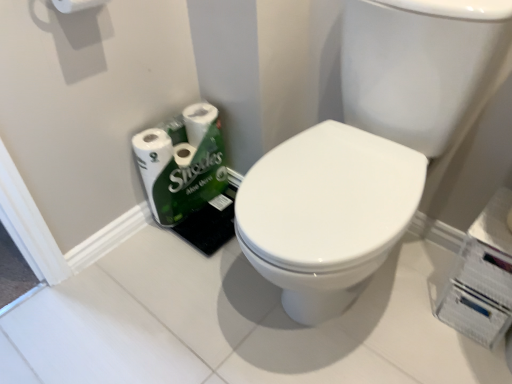
This screenshot has width=512, height=384. Find the location of `white matte toilet paper at upper left, arranged as the second toilet paper when ordered from the bottom`. white matte toilet paper at upper left, arranged as the second toilet paper when ordered from the bottom is located at coordinates (76, 5).

How much space does white glossy toilet paper at lower left, arranged as the first toilet paper when ordered from the bottom, occupy horizontally?

16.22 centimeters.

Locate an element on the screen. white glossy sink at center is located at coordinates (370, 147).

Visually, is white glossy sink at center positioned to the left or to the right of white glossy toilet paper at lower left, the first toilet paper when ordered from back to front?

Clearly, white glossy sink at center is on the right of white glossy toilet paper at lower left, the first toilet paper when ordered from back to front, in the image.

Does white glossy sink at center have a greater height compared to white glossy toilet paper at lower left, arranged as the first toilet paper when ordered from the bottom?

Yes, white glossy sink at center is taller than white glossy toilet paper at lower left, arranged as the first toilet paper when ordered from the bottom.

In the scene shown: Considering their positions, is white glossy sink at center located in front of or behind white glossy toilet paper at lower left, the first toilet paper when ordered from back to front?

white glossy sink at center is in front of white glossy toilet paper at lower left, the first toilet paper when ordered from back to front.

Would you say white matte toilet paper at upper left, positioned as the 1th toilet paper in top-to-bottom order, is outside white glossy toilet paper at lower left, the first toilet paper when ordered from back to front?

Yes, white matte toilet paper at upper left, positioned as the 1th toilet paper in top-to-bottom order, is not within white glossy toilet paper at lower left, the first toilet paper when ordered from back to front.

Is white matte toilet paper at upper left, which ranks as the 2th toilet paper in back-to-front order, facing away from white glossy toilet paper at lower left, arranged as the first toilet paper when ordered from the bottom?

That's not correct — white matte toilet paper at upper left, which ranks as the 2th toilet paper in back-to-front order, is not looking away from white glossy toilet paper at lower left, arranged as the first toilet paper when ordered from the bottom.

In the image, there is a white matte toilet paper at upper left, positioned as the 1th toilet paper in top-to-bottom order. Where is `toilet paper below it (from the image's perspective)`? The height and width of the screenshot is (384, 512). toilet paper below it (from the image's perspective) is located at coordinates (182, 163).

Is white matte toilet paper at upper left, marked as the first toilet paper in a front-to-back arrangement, smaller than white glossy toilet paper at lower left, the second toilet paper positioned from the front?

Yes, white matte toilet paper at upper left, marked as the first toilet paper in a front-to-back arrangement, is smaller than white glossy toilet paper at lower left, the second toilet paper positioned from the front.

Is white glossy toilet paper at lower left, arranged as the first toilet paper when ordered from the bottom, far from white glossy sink at center?

No, there isn't a large distance between white glossy toilet paper at lower left, arranged as the first toilet paper when ordered from the bottom, and white glossy sink at center.

What's the angular difference between white glossy toilet paper at lower left, the second toilet paper positioned from the front, and white glossy sink at center's facing directions?

85.6 degrees.

From the image's perspective, is white glossy toilet paper at lower left, arranged as the first toilet paper when ordered from the bottom, over white glossy sink at center?

Yes.

Considering the sizes of objects white glossy toilet paper at lower left, which is counted as the second toilet paper, starting from the top, and white glossy sink at center in the image provided, who is thinner, white glossy toilet paper at lower left, which is counted as the second toilet paper, starting from the top, or white glossy sink at center?

white glossy toilet paper at lower left, which is counted as the second toilet paper, starting from the top, is thinner.

Choose the correct answer: Is white glossy sink at center inside white matte toilet paper at upper left, arranged as the second toilet paper when ordered from the bottom, or outside it?

white glossy sink at center is not enclosed by white matte toilet paper at upper left, arranged as the second toilet paper when ordered from the bottom.

From a real-world perspective, is white glossy sink at center physically above white matte toilet paper at upper left, marked as the first toilet paper in a front-to-back arrangement?

No, from a real-world perspective, white glossy sink at center is not above white matte toilet paper at upper left, marked as the first toilet paper in a front-to-back arrangement.

From the image's perspective, starting from the white glossy sink at center, which toilet paper is the 2nd one above? Please provide its 2D coordinates.

[(76, 5)]

In the scene shown: Between white matte toilet paper at upper left, positioned as the 1th toilet paper in top-to-bottom order, and white glossy sink at center, which one appears on the left side from the viewer's perspective?

white matte toilet paper at upper left, positioned as the 1th toilet paper in top-to-bottom order, is more to the left.

From the image's perspective, is white matte toilet paper at upper left, which ranks as the 2th toilet paper in back-to-front order, on white glossy sink at center?

Yes.

From a real-world perspective, who is located lower, white matte toilet paper at upper left, which ranks as the 2th toilet paper in back-to-front order, or white glossy sink at center?

white glossy sink at center is physically lower.

The image size is (512, 384). In order to click on toilet paper above the white glossy sink at center (from a real-world perspective) in this screenshot , I will do `click(76, 5)`.

From the image's perspective, between white glossy toilet paper at lower left, arranged as the first toilet paper when ordered from the bottom, and white matte toilet paper at upper left, arranged as the second toilet paper when ordered from the bottom, who is located below?

white glossy toilet paper at lower left, arranged as the first toilet paper when ordered from the bottom, appears lower in the image.

Considering the sizes of objects white glossy toilet paper at lower left, arranged as the first toilet paper when ordered from the bottom, and white matte toilet paper at upper left, marked as the first toilet paper in a front-to-back arrangement, in the image provided, who is taller, white glossy toilet paper at lower left, arranged as the first toilet paper when ordered from the bottom, or white matte toilet paper at upper left, marked as the first toilet paper in a front-to-back arrangement,?

white glossy toilet paper at lower left, arranged as the first toilet paper when ordered from the bottom.

Is white glossy toilet paper at lower left, the second toilet paper positioned from the front, located outside white matte toilet paper at upper left, marked as the first toilet paper in a front-to-back arrangement?

white glossy toilet paper at lower left, the second toilet paper positioned from the front, lies outside white matte toilet paper at upper left, marked as the first toilet paper in a front-to-back arrangement,'s area.

Where is `toilet paper beneath the white matte toilet paper at upper left, marked as the first toilet paper in a front-to-back arrangement (from a real-world perspective)`? The height and width of the screenshot is (384, 512). toilet paper beneath the white matte toilet paper at upper left, marked as the first toilet paper in a front-to-back arrangement (from a real-world perspective) is located at coordinates (182, 163).

Locate an element on the screen. The width and height of the screenshot is (512, 384). the 2nd toilet paper behind the white glossy sink at center, counting from the anchor's position is located at coordinates (182, 163).

At what (x,y) coordinates should I click in order to perform the action: click on toilet paper below the white matte toilet paper at upper left, marked as the first toilet paper in a front-to-back arrangement (from a real-world perspective). Please return your answer as a coordinate pair (x, y). The image size is (512, 384). Looking at the image, I should click on (182, 163).

Based on their spatial positions, is white glossy toilet paper at lower left, the second toilet paper positioned from the front, or white glossy sink at center closer to white matte toilet paper at upper left, marked as the first toilet paper in a front-to-back arrangement?

Based on the image, white glossy toilet paper at lower left, the second toilet paper positioned from the front, appears to be nearer to white matte toilet paper at upper left, marked as the first toilet paper in a front-to-back arrangement.

When comparing their distances from white glossy toilet paper at lower left, arranged as the first toilet paper when ordered from the bottom, does white matte toilet paper at upper left, arranged as the second toilet paper when ordered from the bottom, or white glossy sink at center seem further?

Based on the image, white matte toilet paper at upper left, arranged as the second toilet paper when ordered from the bottom, appears to be further to white glossy toilet paper at lower left, arranged as the first toilet paper when ordered from the bottom.

In the scene shown: Estimate the real-world distances between objects in this image. Which object is closer to white matte toilet paper at upper left, positioned as the 1th toilet paper in top-to-bottom order, white glossy sink at center or white glossy toilet paper at lower left, which is counted as the second toilet paper, starting from the top?

Based on the image, white glossy toilet paper at lower left, which is counted as the second toilet paper, starting from the top, appears to be nearer to white matte toilet paper at upper left, positioned as the 1th toilet paper in top-to-bottom order.

When comparing their distances from white glossy sink at center, does white glossy toilet paper at lower left, arranged as the first toilet paper when ordered from the bottom, or white matte toilet paper at upper left, positioned as the 1th toilet paper in top-to-bottom order, seem further?

Among the two, white matte toilet paper at upper left, positioned as the 1th toilet paper in top-to-bottom order, is located further to white glossy sink at center.

Considering their positions, is white matte toilet paper at upper left, positioned as the 1th toilet paper in top-to-bottom order, positioned closer to white glossy sink at center than white glossy toilet paper at lower left, arranged as the first toilet paper when ordered from the bottom?

white glossy toilet paper at lower left, arranged as the first toilet paper when ordered from the bottom.

Looking at the image, which one is located further to white glossy toilet paper at lower left, the first toilet paper when ordered from back to front, white glossy sink at center or white matte toilet paper at upper left, marked as the first toilet paper in a front-to-back arrangement?

white matte toilet paper at upper left, marked as the first toilet paper in a front-to-back arrangement.

This screenshot has height=384, width=512. Identify the location of toilet paper between white glossy sink at center and white glossy toilet paper at lower left, arranged as the first toilet paper when ordered from the bottom, along the z-axis. (76, 5).